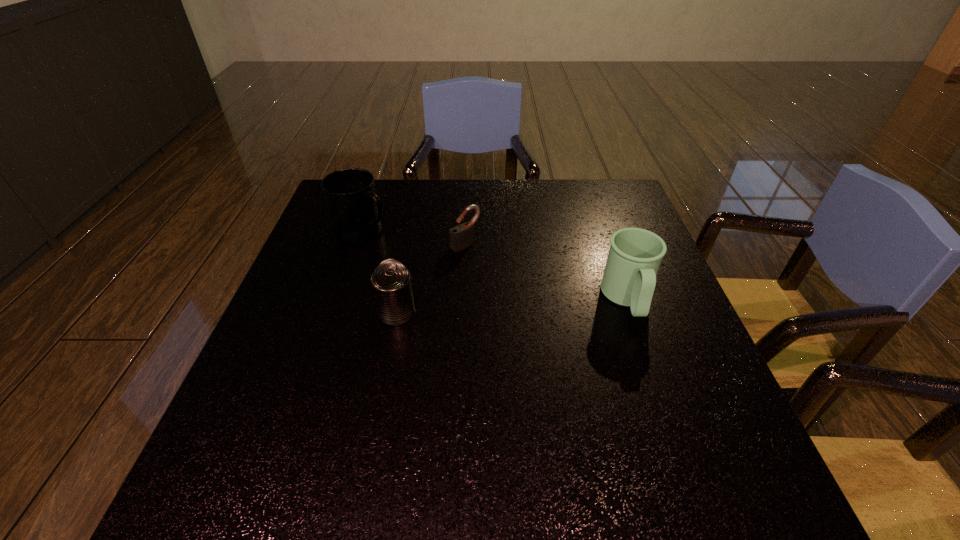
Identify the location of vacant space at the left edge of the desktop. (360, 255).

In the image, there is a desktop. Where is `vacant space at the right edge`? This screenshot has height=540, width=960. vacant space at the right edge is located at coordinates (691, 328).

Identify the location of free space at the far right corner of the desktop. The height and width of the screenshot is (540, 960). (635, 215).

At what (x,y) coordinates should I click in order to perform the action: click on blank space at the near right corner of the desktop. Please return your answer as a coordinate pair (x, y). The width and height of the screenshot is (960, 540). Looking at the image, I should click on (652, 404).

Where is `vacant point located between the nearer mug and the second object from right to left`? Image resolution: width=960 pixels, height=540 pixels. vacant point located between the nearer mug and the second object from right to left is located at coordinates (546, 272).

This screenshot has width=960, height=540. Find the location of `vacant area that lies between the shortest object and the leftmost object`. vacant area that lies between the shortest object and the leftmost object is located at coordinates (415, 238).

This screenshot has width=960, height=540. In order to click on empty space that is in between the farther mug and the shortest object in this screenshot , I will do `click(415, 238)`.

Where is `free space between the left mug and the nearer mug`? This screenshot has width=960, height=540. free space between the left mug and the nearer mug is located at coordinates (495, 265).

The height and width of the screenshot is (540, 960). I want to click on unoccupied area between the right mug and the second object from left to right, so click(513, 306).

The image size is (960, 540). I want to click on free space between the third object from right to left and the rightmost object, so click(513, 306).